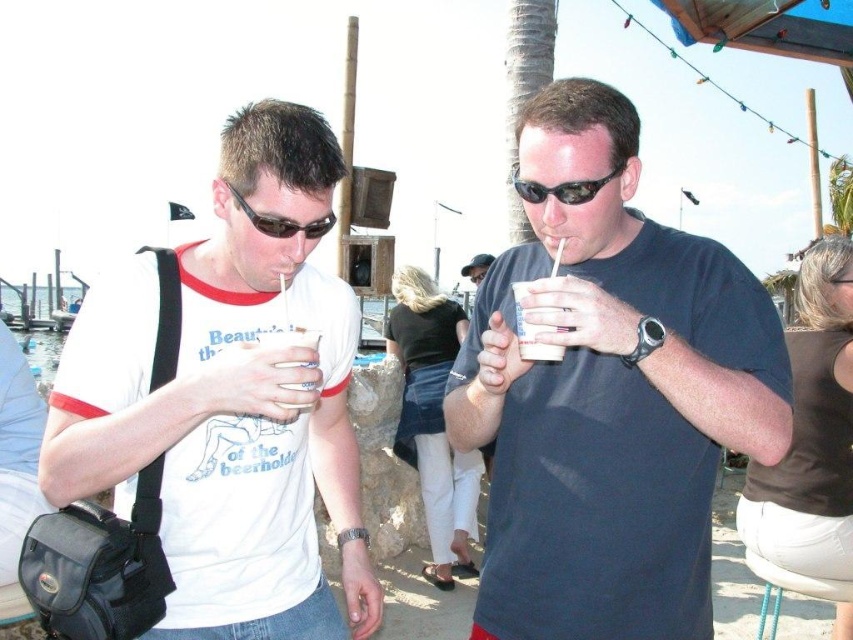
Question: Does black plastic sunglasses at center have a larger size compared to matte black sunglasses at upper center?

Choices:
 (A) no
 (B) yes

Answer: (B)

Question: Among these points, which one is nearest to the camera?

Choices:
 (A) (334, 220)
 (B) (540, 448)
 (C) (148, 275)
 (D) (521, 193)

Answer: (A)

Question: Does matte black cup at center appear over matte black sunglasses at upper center?

Choices:
 (A) no
 (B) yes

Answer: (A)

Question: Does white matte t-shirt at left appear under matte black sunglasses at upper center?

Choices:
 (A) no
 (B) yes

Answer: (B)

Question: Which object is closer to the camera taking this photo?

Choices:
 (A) matte black cup at center
 (B) black plastic sunglasses at center
 (C) matte black sunglasses at upper center
 (D) white matte t-shirt at left

Answer: (A)

Question: Which point is closer to the camera?

Choices:
 (A) (229, 541)
 (B) (570, 182)

Answer: (B)